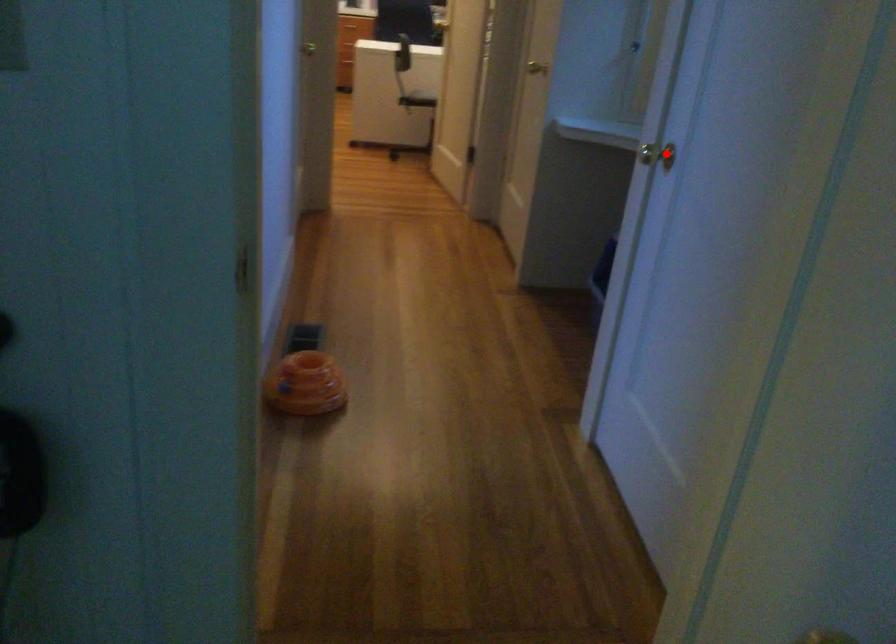
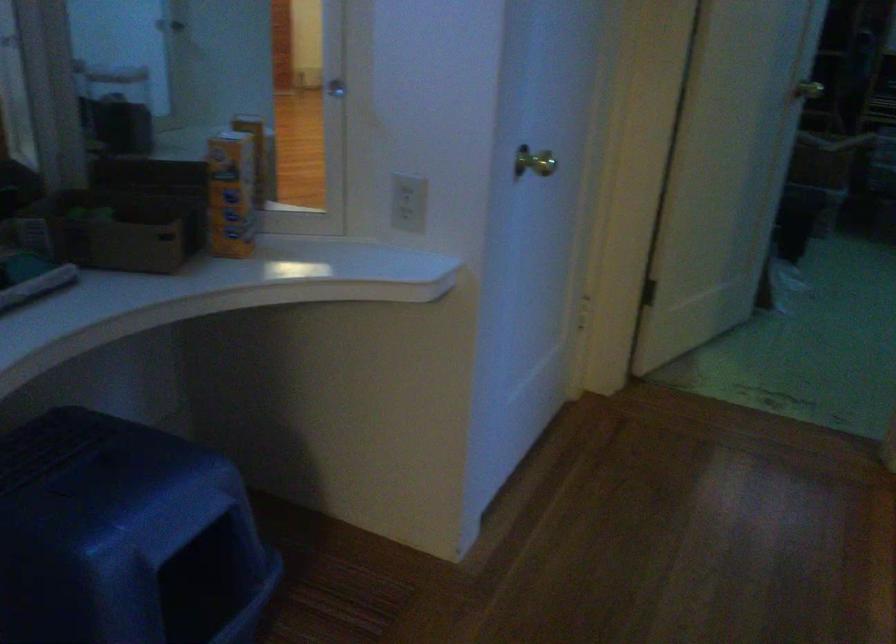
Locate, in the second image, the point that corresponds to the highlighted location in the first image.

(533, 162)